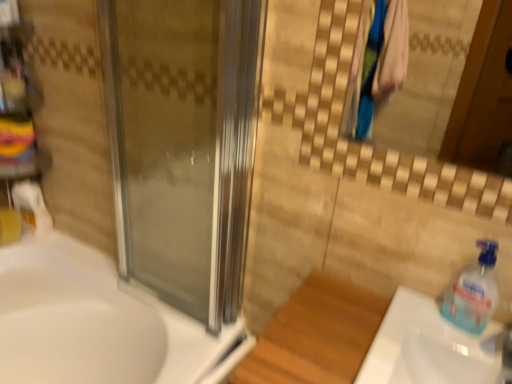
Question: From a real-world perspective, is white glossy sink at lower right, the 1th sink in the right-to-left sequence, above or below transparent plastic soap dispenser at right?

Choices:
 (A) above
 (B) below

Answer: (B)

Question: Is white glossy sink at lower right, the second sink in the back-to-front sequence, in front of or behind transparent plastic soap dispenser at right in the image?

Choices:
 (A) front
 (B) behind

Answer: (A)

Question: Which object is positioned farthest from the white glossy sink at lower right, the first sink viewed from the front?

Choices:
 (A) transparent plastic soap dispenser at right
 (B) white glossy sink at lower left, which is the second sink from front to back
 (C) transparent glass screen door at center

Answer: (B)

Question: Considering the real-world distances, which object is closest to the white glossy sink at lower left, arranged as the 2th sink when viewed from the right?

Choices:
 (A) white glossy sink at lower right, which is counted as the 2th sink, starting from the left
 (B) transparent plastic soap dispenser at right
 (C) transparent glass screen door at center

Answer: (C)